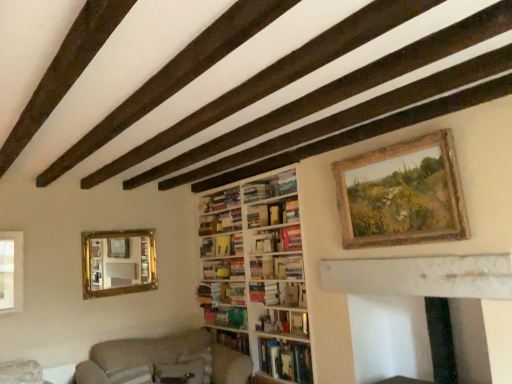
The image size is (512, 384). What do you see at coordinates (286, 360) in the screenshot? I see `hardcover book at center, the 1th book ordered from the bottom` at bounding box center [286, 360].

Describe the element at coordinates (264, 293) in the screenshot. I see `hardcover book at center, which is the fourth book from bottom to top` at that location.

What is the approximate width of beige fabric couch at lower left?

beige fabric couch at lower left is 36.23 inches wide.

At what (x,y) coordinates should I click in order to perform the action: click on beige fabric couch at lower left. Please return your answer as a coordinate pair (x, y). The height and width of the screenshot is (384, 512). Looking at the image, I should click on (164, 360).

Locate an element on the screen. This screenshot has width=512, height=384. hardcover book at center, the 1th book ordered from the bottom is located at coordinates (286, 360).

Which of these two, wooden rustic frame at upper right or hardcover book at upper center, which appears as the first book when viewed from the top, is wider?

With larger width is wooden rustic frame at upper right.

Is wooden rustic frame at upper right facing away from hardcover book at upper center, which appears as the first book when viewed from the top?

wooden rustic frame at upper right does not have its back to hardcover book at upper center, which appears as the first book when viewed from the top.

Is wooden rustic frame at upper right in front of or behind hardcover book at upper center, which appears as the first book when viewed from the top, in the image?

Visually, wooden rustic frame at upper right is located in front of hardcover book at upper center, which appears as the first book when viewed from the top.

Can hardcover book at upper center, the 9th book positioned from the bottom, be found inside wooden rustic frame at upper right?

Definitely not — hardcover book at upper center, the 9th book positioned from the bottom, is not inside wooden rustic frame at upper right.

From a real-world perspective, between wooden rustic frame at upper right and hardcover book at center, the second book when ordered from top to bottom, who is vertically lower?

From a 3D spatial view, wooden rustic frame at upper right is below.

Is wooden rustic frame at upper right further to camera compared to hardcover book at center, which appears as the eighth book when ordered from the bottom?

No, the depth of wooden rustic frame at upper right is less than that of hardcover book at center, which appears as the eighth book when ordered from the bottom.

Is wooden rustic frame at upper right facing towards hardcover book at center, the second book when ordered from top to bottom?

No.

How different are the orientations of wooden rustic frame at upper right and hardcover book at center, which appears as the eighth book when ordered from the bottom, in degrees?

wooden rustic frame at upper right and hardcover book at center, which appears as the eighth book when ordered from the bottom, are facing 0.395 degrees away from each other.

Between hardcover books at center, the 3th book positioned from the top, and beige fabric couch at lower left, which one has smaller size?

With smaller size is hardcover books at center, the 3th book positioned from the top.

Is hardcover books at center, marked as the seventh book in a bottom-to-top arrangement, facing towards beige fabric couch at lower left?

No, hardcover books at center, marked as the seventh book in a bottom-to-top arrangement, is not facing towards beige fabric couch at lower left.

Is hardcover books at center, the 3th book positioned from the top, wider or thinner than beige fabric couch at lower left?

hardcover books at center, the 3th book positioned from the top, is thinner than beige fabric couch at lower left.

Considering the positions of points (222, 200) and (178, 341), is point (222, 200) farther from camera compared to point (178, 341)?

Yes, it is.

Is hardcover books at center, the 3th book positioned from the top, at the right side of gold-framed mirror at left?

Yes.

Which of these two, hardcover books at center, marked as the seventh book in a bottom-to-top arrangement, or gold-framed mirror at left, stands shorter?

With less height is hardcover books at center, marked as the seventh book in a bottom-to-top arrangement.

Which of these two, hardcover books at center, the 3th book positioned from the top, or gold-framed mirror at left, is thinner?

gold-framed mirror at left.

Is hardcover books at center, marked as the seventh book in a bottom-to-top arrangement, positioned with its back to gold-framed mirror at left?

No, hardcover books at center, marked as the seventh book in a bottom-to-top arrangement, is not facing the opposite direction of gold-framed mirror at left.

Which is behind, point (420, 267) or point (221, 208)?

Positioned behind is point (221, 208).

Is white marble fireplace at lower right smaller than hardcover books at center, marked as the seventh book in a bottom-to-top arrangement?

Incorrect, white marble fireplace at lower right is not smaller in size than hardcover books at center, marked as the seventh book in a bottom-to-top arrangement.

You are a GUI agent. You are given a task and a screenshot of the screen. Output one action in this format:
    pyautogui.click(x=<x>, y=<y>)
    Task: Click on the fireplace that is on the right side of hardcover books at center, the 3th book positioned from the top
    The height and width of the screenshot is (384, 512).
    Given the screenshot: What is the action you would take?
    pyautogui.click(x=422, y=276)

From the picture: From a real-world perspective, is white marble fireplace at lower right physically located above or below hardcover books at center, the 3th book positioned from the top?

Clearly, from a real-world perspective, white marble fireplace at lower right is below hardcover books at center, the 3th book positioned from the top.

Could white wooden bookcase at center be considered to be inside hardcover book at upper center, the 9th book positioned from the bottom?

No, white wooden bookcase at center is located outside of hardcover book at upper center, the 9th book positioned from the bottom.

From a real-world perspective, which object rests below the other?

white wooden bookcase at center, from a real-world perspective.

From the image's perspective, between hardcover book at upper center, which appears as the first book when viewed from the top, and white wooden bookcase at center, who is located below?

white wooden bookcase at center.

Considering the positions of points (287, 191) and (275, 307), is point (287, 191) farther from camera compared to point (275, 307)?

No.

Looking at this image, is hardcover book at center, marked as the 9th book in a top-to-bottom arrangement, thinner than gold-framed mirror at left?

Incorrect, the width of hardcover book at center, marked as the 9th book in a top-to-bottom arrangement, is not less than that of gold-framed mirror at left.

Relative to gold-framed mirror at left, is hardcover book at center, marked as the 9th book in a top-to-bottom arrangement, in front or behind?

hardcover book at center, marked as the 9th book in a top-to-bottom arrangement, is in front of gold-framed mirror at left.

Is hardcover book at center, the 1th book ordered from the bottom, to the left or to the right of gold-framed mirror at left in the image?

hardcover book at center, the 1th book ordered from the bottom, is to the right of gold-framed mirror at left.

Could you measure the distance between hardcover book at center, the 1th book ordered from the bottom, and gold-framed mirror at left?

hardcover book at center, the 1th book ordered from the bottom, is 1.67 meters from gold-framed mirror at left.

Where is `the 3rd book to the left of the wooden rustic frame at upper right, starting your count from the anchor`? This screenshot has height=384, width=512. the 3rd book to the left of the wooden rustic frame at upper right, starting your count from the anchor is located at coordinates (287, 182).

From the image's perspective, which book is the 1st one above the wooden rustic frame at upper right? Please provide its 2D coordinates.

[(258, 191)]

Considering their positions, is hardcover book at center, marked as the sixth book in a bottom-to-top arrangement, positioned closer to green matte book at center, placed as the eighth book when sorted from top to bottom, than hardcover books at center, which is the 5th book in bottom-to-top order?

hardcover books at center, which is the 5th book in bottom-to-top order, lies closer to green matte book at center, placed as the eighth book when sorted from top to bottom, than the other object.

Estimate the real-world distances between objects in this image. Which object is further from wooden rustic frame at upper right, hardcover books at center, marked as the seventh book in a bottom-to-top arrangement, or hardcover book at center, which ranks as the 4th book in top-to-bottom order?

hardcover books at center, marked as the seventh book in a bottom-to-top arrangement.

From the image, which object appears to be farther from white wooden bookcase at center, hardcover book at center, which is counted as the 3th book, starting from the bottom, or hardcover books at center, the 3th book positioned from the top?

Among the two, hardcover books at center, the 3th book positioned from the top, is located further to white wooden bookcase at center.

Looking at this image, considering their positions, is hardcover book at center, the second book when ordered from top to bottom, positioned closer to beige fabric couch at lower left than hardcover books at center, which is the 5th book in bottom-to-top order?

hardcover books at center, which is the 5th book in bottom-to-top order, is closer to beige fabric couch at lower left.

Looking at this image, estimate the real-world distances between objects in this image. Which object is further from beige fabric couch at lower left, wooden bookshelf at center or hardcover book at upper center, which appears as the first book when viewed from the top?

Among the two, hardcover book at upper center, which appears as the first book when viewed from the top, is located further to beige fabric couch at lower left.

Which object lies nearer to the anchor point hardcover book at center, which appears as the eighth book when ordered from the bottom, beige fabric couch at lower left or hardcover book at center, which is counted as the sixth book, starting from the top?

hardcover book at center, which is counted as the sixth book, starting from the top, is closer to hardcover book at center, which appears as the eighth book when ordered from the bottom.

Which object lies nearer to the anchor point hardcover book at center, which appears as the eighth book when ordered from the bottom, gold-framed mirror at left or green matte book at center, placed as the eighth book when sorted from top to bottom?

green matte book at center, placed as the eighth book when sorted from top to bottom, lies closer to hardcover book at center, which appears as the eighth book when ordered from the bottom, than the other object.

Which object lies nearer to the anchor point beige fabric couch at lower left, hardcover book at center, the 1th book ordered from the bottom, or white marble fireplace at lower right?

hardcover book at center, the 1th book ordered from the bottom, is positioned closer to the anchor beige fabric couch at lower left.

Identify the location of picture frame between hardcover book at center, the second book when ordered from top to bottom, and hardcover book at center, the 1th book ordered from the bottom, from top to bottom. Image resolution: width=512 pixels, height=384 pixels. (404, 196).

Find the location of a particular element. This screenshot has height=384, width=512. bookcase between wooden rustic frame at upper right and white marble fireplace at lower right vertically is located at coordinates (262, 281).

The image size is (512, 384). In order to click on shelf between white marble fireplace at lower right and hardcover book at center, which ranks as the 4th book in top-to-bottom order, along the z-axis in this screenshot , I will do `click(221, 293)`.

Where is `picture frame that lies between hardcover book at center, the second book when ordered from top to bottom, and beige fabric couch at lower left from top to bottom`? Image resolution: width=512 pixels, height=384 pixels. picture frame that lies between hardcover book at center, the second book when ordered from top to bottom, and beige fabric couch at lower left from top to bottom is located at coordinates (404, 196).